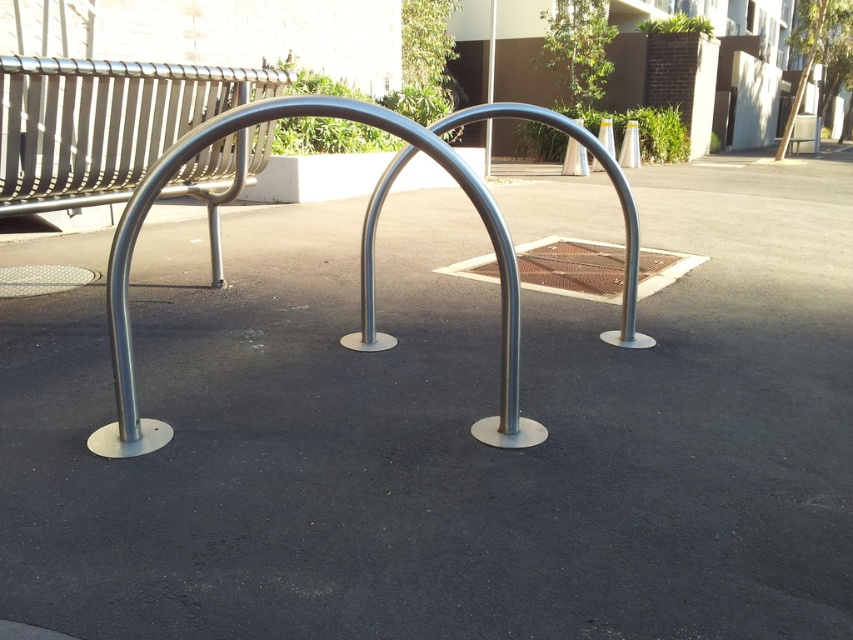
You are a city planner reviewing this urban space. You need to determine if the satin silver bench at upper left is positioned in a way that it is elevated compared to the polished metal bike rack at center. Based on the scene, can you confirm this?

The satin silver bench at upper left is above the polished metal bike rack at center, so yes, it is elevated in position compared to the bike rack.

You are a city planner evaluating the space between the satin silver bench at upper left and the silver metallic pole at center. Based on their sizes, which object would be more suitable for installing a small information plaque?

The satin silver bench at upper left has a larger size compared to the silver metallic pole at center, making it more suitable for installing a small information plaque as there is more space available.

You are standing at the point marked by the coordinates point (361, 256). Looking around, you see a polished metal bike rack at center. Which direction should you face to see the drainage grate near the center right of the frame?

The drainage grate near the center right of the frame is located to the right of the point (361, 256), so you should face towards the right direction to see it.